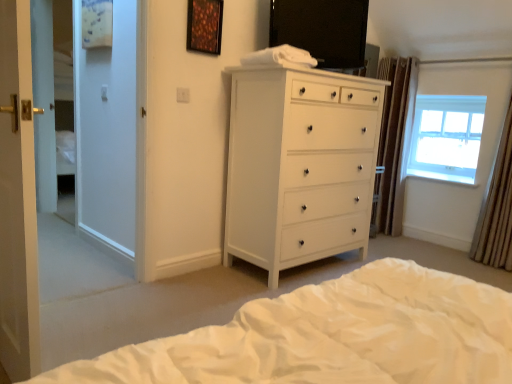
Question: Is white glossy door at left not inside white soft bed at lower center?

Choices:
 (A) yes
 (B) no

Answer: (A)

Question: Is white soft bed at lower center located within white glossy door at left?

Choices:
 (A) no
 (B) yes

Answer: (A)

Question: From a real-world perspective, is white glossy door at left under white soft bed at lower center?

Choices:
 (A) no
 (B) yes

Answer: (A)

Question: Does white glossy door at left appear on the left side of white soft bed at lower center?

Choices:
 (A) yes
 (B) no

Answer: (A)

Question: Are white glossy door at left and white soft bed at lower center located far from each other?

Choices:
 (A) no
 (B) yes

Answer: (A)

Question: In terms of size, does brown textured curtain at right, the 2th curtain viewed from the front, appear bigger or smaller than white glossy chest of drawers at center?

Choices:
 (A) big
 (B) small

Answer: (B)

Question: Is brown textured curtain at right, the 2th curtain from the right, inside the boundaries of white glossy chest of drawers at center, or outside?

Choices:
 (A) inside
 (B) outside

Answer: (B)

Question: Looking at their shapes, would you say brown textured curtain at right, the 1th curtain when ordered from back to front, is wider or thinner than white glossy chest of drawers at center?

Choices:
 (A) wide
 (B) thin

Answer: (B)

Question: Is brown textured curtain at right, the first curtain viewed from the left, in front of or behind white glossy chest of drawers at center in the image?

Choices:
 (A) behind
 (B) front

Answer: (A)

Question: Does point (493, 185) appear closer or farther from the camera than point (412, 294)?

Choices:
 (A) farther
 (B) closer

Answer: (A)

Question: Is brown textured curtain at right, which is the first curtain from right to left, to the left or to the right of white soft bed at lower center in the image?

Choices:
 (A) right
 (B) left

Answer: (A)

Question: Is brown textured curtain at right, which is the first curtain from right to left, taller or shorter than white soft bed at lower center?

Choices:
 (A) tall
 (B) short

Answer: (A)

Question: From the image's perspective, is brown textured curtain at right, the 1th curtain viewed from the front, positioned above or below white soft bed at lower center?

Choices:
 (A) below
 (B) above

Answer: (B)

Question: From the image's perspective, is wooden frame at upper center positioned above or below brown textured curtain at right, the 1th curtain viewed from the front?

Choices:
 (A) below
 (B) above

Answer: (B)

Question: Based on their positions, is wooden frame at upper center located to the left or right of brown textured curtain at right, which is the first curtain from right to left?

Choices:
 (A) left
 (B) right

Answer: (A)